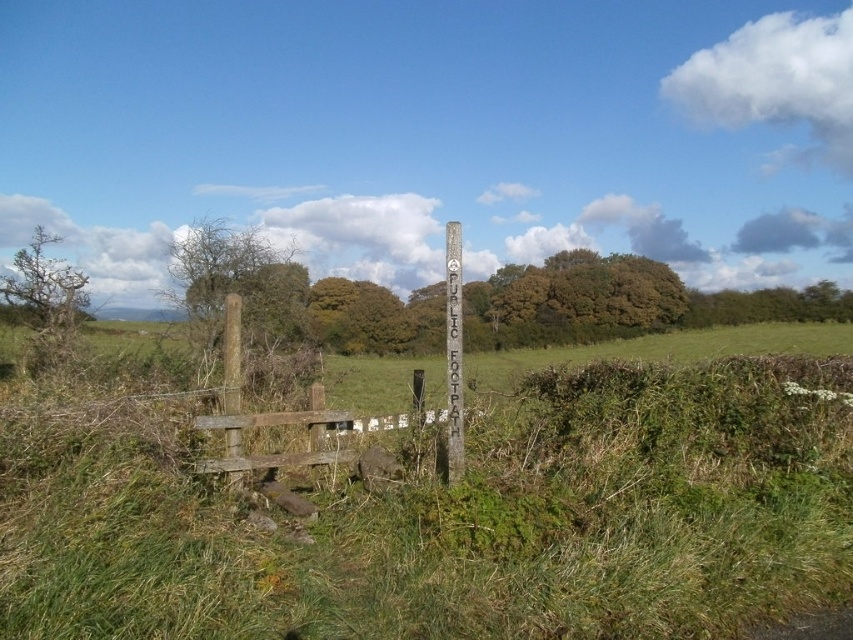
You are a hiker trying to cross the field. You see the green grassy at center and the brown wooden post at left. Which one is larger in size?

The green grassy at center is bigger than the brown wooden post at left.

You are standing at the brown wooden fence at lower left and want to walk towards the green grassy area at center. Which direction should you move to reach the green grassy at center?

The green grassy at center is positioned on the right side of brown wooden fence at lower left, so you should move to the right to reach it.